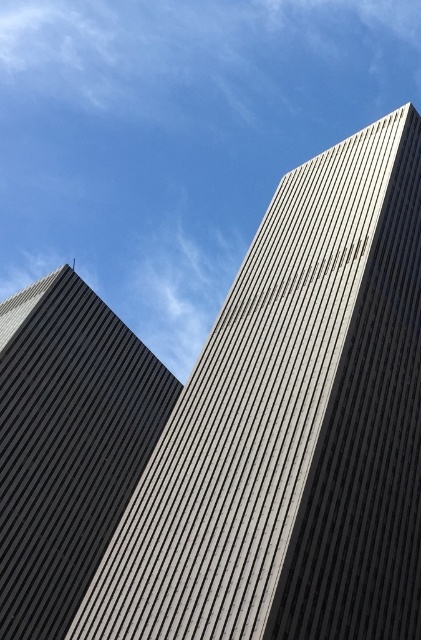
You are standing at the base of the two skyscrapers in the image. There is a point marked at coordinates (293, 428). Which building does this point indicate?

The point at coordinates (293, 428) marks the gray textured building at center.

You are standing on the street looking up at the two skyscrapers. Which building, the gray textured building at center or the dark gray textured building at left, would appear larger to you?

The gray textured building at center appears larger because it is closer to the viewer than the dark gray textured building at left.